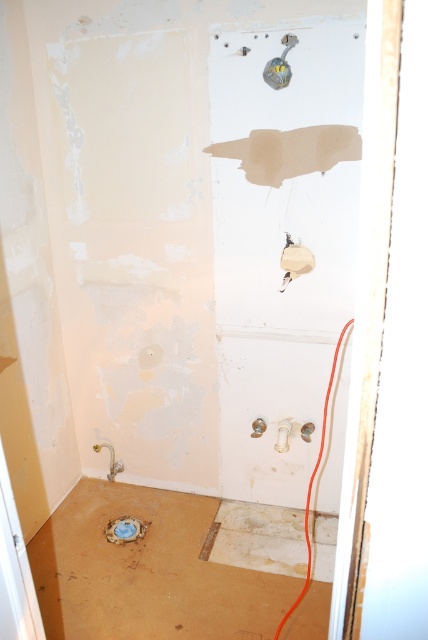
You are an electrician installing a new outlet in the bathroom. The existing outlet is at point (294, 260). Where should you place the new outlet to avoid the existing one?

The existing outlet is at point (294, 260), so you should place the new outlet at a different coordinate to avoid overlapping with the existing one.

You are a technician holding a tool that is 1.5 meters long. You need to reach the matte white outlet at center from your current position. Can you reach it without moving closer?

The matte white outlet at center is 2.07 meters away from the camera. Since your tool is only 1.5 meters long, you cannot reach it without moving closer.

You are an electrician installing a new outlet in the bathroom. The existing matte white outlet at center is located at coordinates point 0.408, 0.689. If you need to place a new outlet 15 cm to the right of the existing one, what would be the new coordinates?

The new coordinates would be approximately [294,356] since moving 15 cm to the right adds 0.15 to the x coordinate, keeping the y coordinate the same.